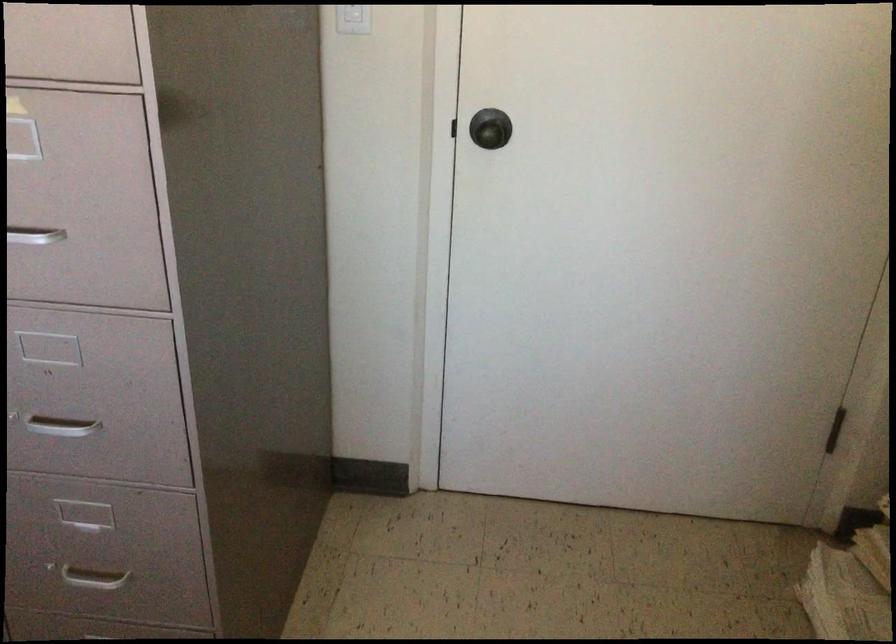
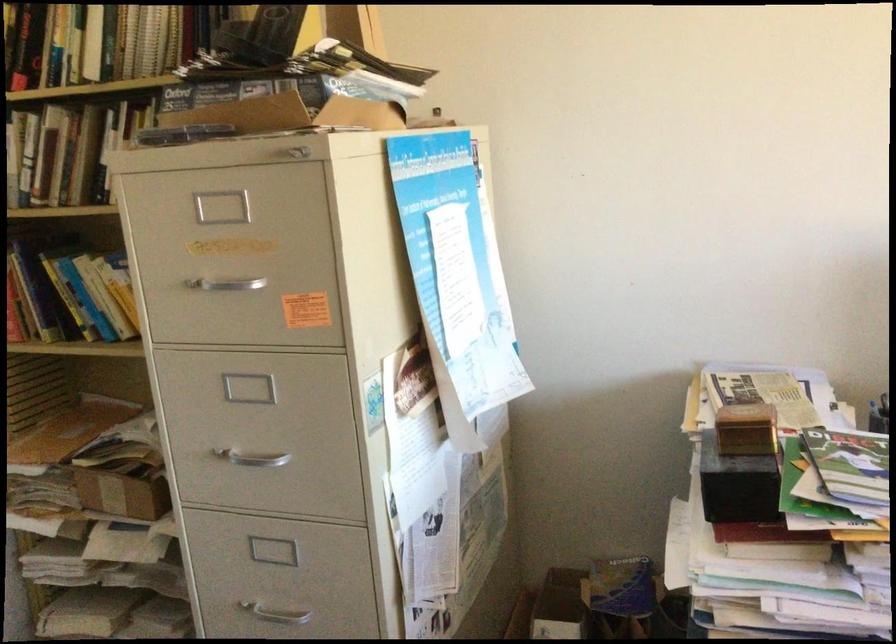
Question: How did the camera likely rotate?

Choices:
 (A) Left
 (B) Right
 (C) Up
 (D) Down

Answer: (B)